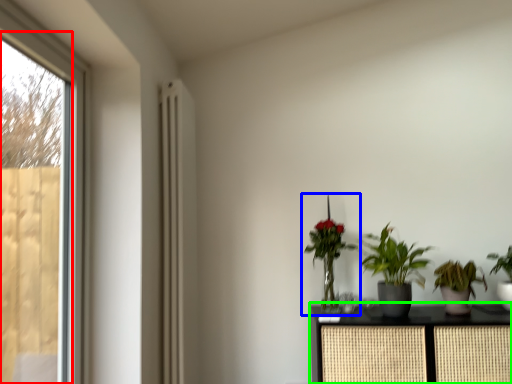
Question: Estimate the real-world distances between objects in this image. Which object is farther from screen door (highlighted by a red box), houseplant (highlighted by a blue box) or furniture (highlighted by a green box)?

Choices:
 (A) houseplant
 (B) furniture

Answer: (B)